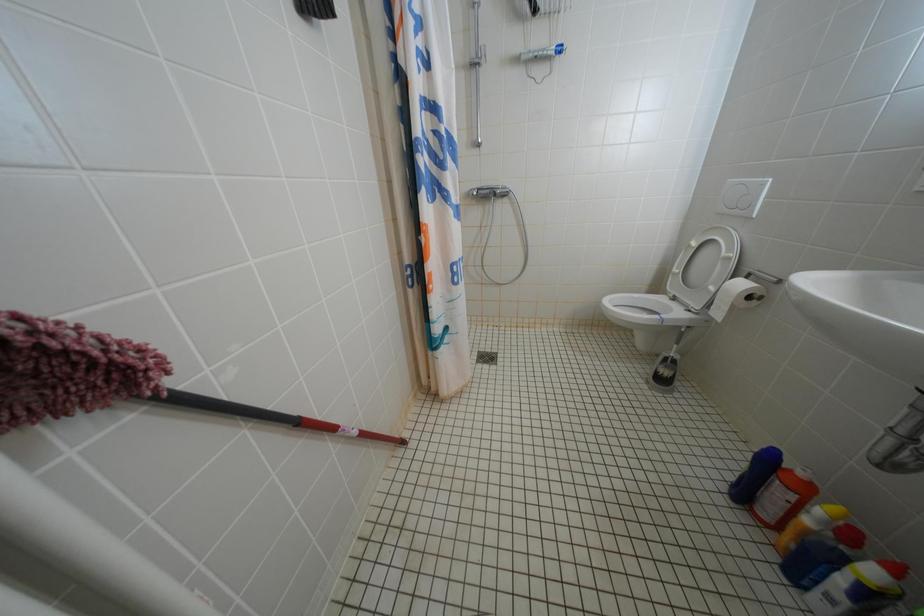
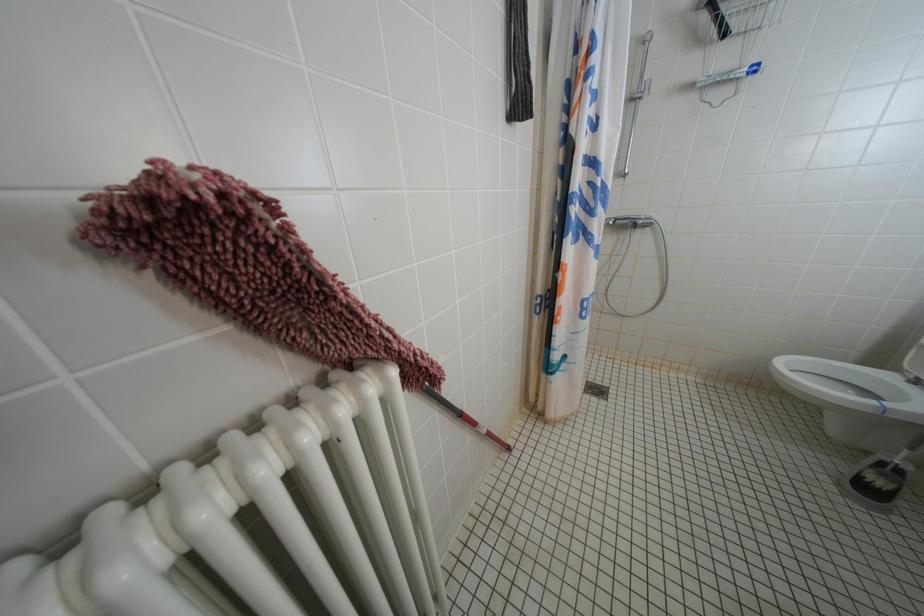
Question: The images are taken continuously from a first-person perspective. In which direction is your viewpoint rotating?

Choices:
 (A) Left
 (B) Right
 (C) Up
 (D) Down

Answer: (A)